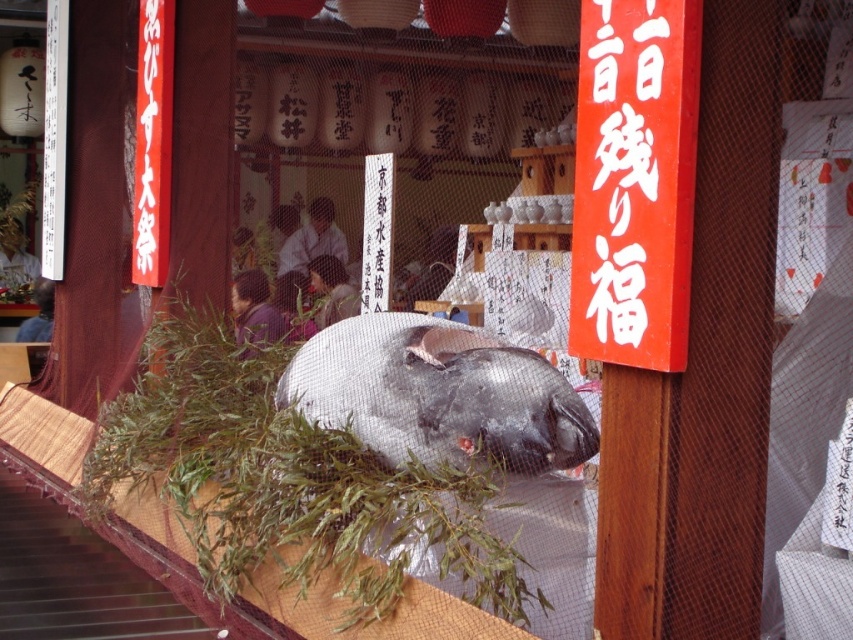
Question: Among these objects, which one is farthest from the camera?

Choices:
 (A) white paper sign at upper center
 (B) shiny silver fish at center

Answer: (B)

Question: Which point is closer to the camera taking this photo?

Choices:
 (A) (602, 301)
 (B) (549, 428)

Answer: (A)

Question: From the image, what is the correct spatial relationship of shiny silver fish at center in relation to white paper sign at upper center?

Choices:
 (A) right
 (B) left

Answer: (B)

Question: Is shiny silver fish at center to the left of white paper sign at upper center from the viewer's perspective?

Choices:
 (A) no
 (B) yes

Answer: (B)

Question: From the image, what is the correct spatial relationship of shiny silver fish at center in relation to white paper sign at upper center?

Choices:
 (A) right
 (B) left

Answer: (B)